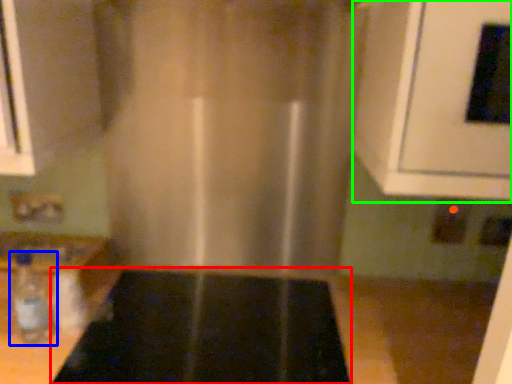
Question: Considering the real-world distances, which object is closest to appliance (highlighted by a red box)? bottle (highlighted by a blue box) or oven (highlighted by a green box).

Choices:
 (A) bottle
 (B) oven

Answer: (A)